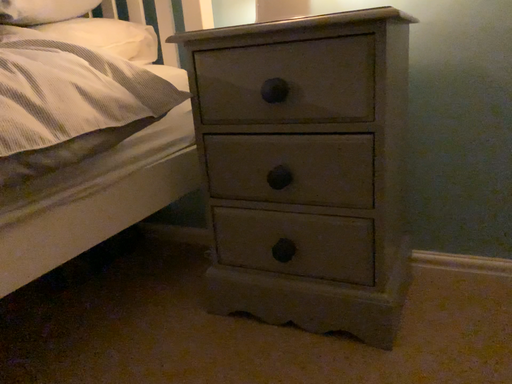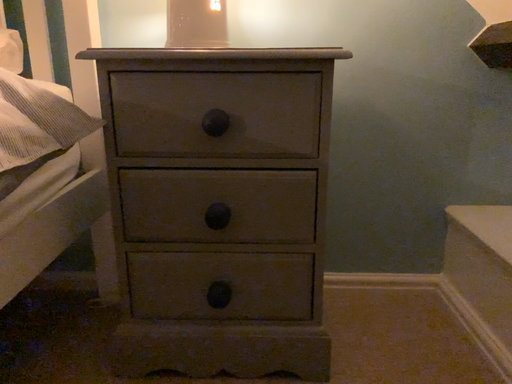
Question: How did the camera likely rotate when shooting the video?

Choices:
 (A) rotated right
 (B) rotated left

Answer: (A)